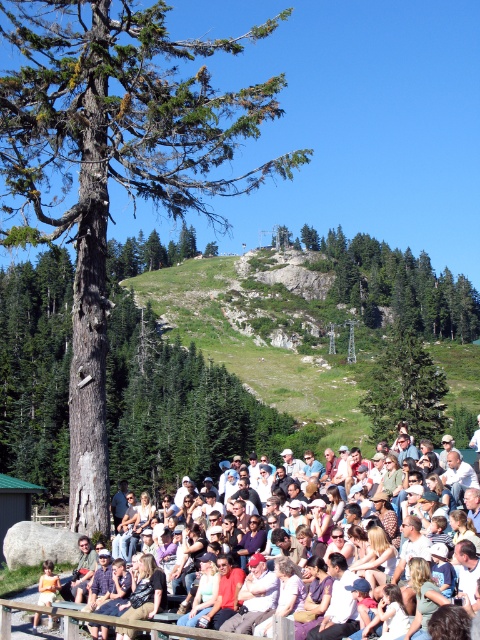
You are standing in the crowd watching the event. There are two points marked in the scene. Which point is closer to you, point [87,211] or point [72,602]?

Point [87,211] is closer to you because it is further to the viewer than point [72,602].

You are a hiker who wants to place a 1.2 meter tall tent between the green textured rock at upper center and the green matte tree at center. Can the tent fit vertically between them?

The green textured rock at upper center is taller than the green matte tree at center. Since the rock is taller, the vertical space between them may not be sufficient to accommodate a 1.2 meter tall tent. You should check the actual distance between them to ensure the tent fits.